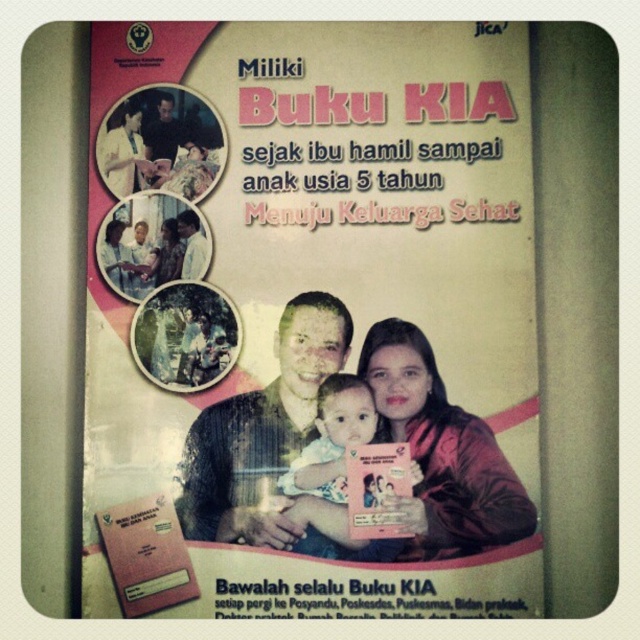
Can you confirm if pink satin jacket at center is taller than soft pink fabric baby at center?

Indeed, pink satin jacket at center has a greater height compared to soft pink fabric baby at center.

Does pink satin jacket at center have a larger size compared to soft pink fabric baby at center?

Correct, pink satin jacket at center is larger in size than soft pink fabric baby at center.

Who is more forward, (458, 525) or (356, 381)?

Point (458, 525) is more forward.

Image resolution: width=640 pixels, height=640 pixels. What are the coordinates of `pink satin jacket at center` in the screenshot? It's located at (440, 451).

Is matte black laptop at upper left shorter than matte white shirt at center?

Incorrect, matte black laptop at upper left's height does not fall short of matte white shirt at center's.

Is matte black laptop at upper left wider than matte white shirt at center?

Indeed, matte black laptop at upper left has a greater width compared to matte white shirt at center.

Between point (164, 132) and point (177, 252), which one is positioned behind?

The point (164, 132) is more distant.

Locate an element on the screen. The height and width of the screenshot is (640, 640). matte black laptop at upper left is located at coordinates (161, 144).

Does pink satin jacket at center come behind matte black laptop at upper left?

No.

Between point (433, 397) and point (221, 154), which one is positioned behind?

Point (221, 154)

Where is `pink satin jacket at center`? Image resolution: width=640 pixels, height=640 pixels. pink satin jacket at center is located at coordinates tap(440, 451).